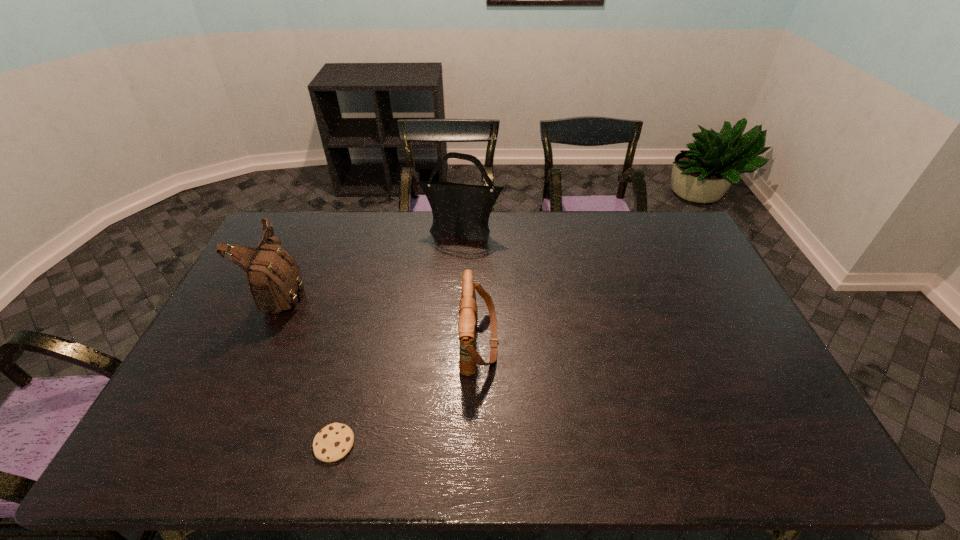
Select which shoulder bag appears as the second closest to the second tallest object. Please provide its 2D coordinates. Your answer should be formatted as a tuple, i.e. [(x, y)], where the tuple contains the x and y coordinates of a point satisfying the conditions above.

[(468, 311)]

Locate an element on the screen. The image size is (960, 540). free space that satisfies the following two spatial constraints: 1. on the front-facing side of the cookie; 2. on the left side of the leftmost object is located at coordinates (215, 444).